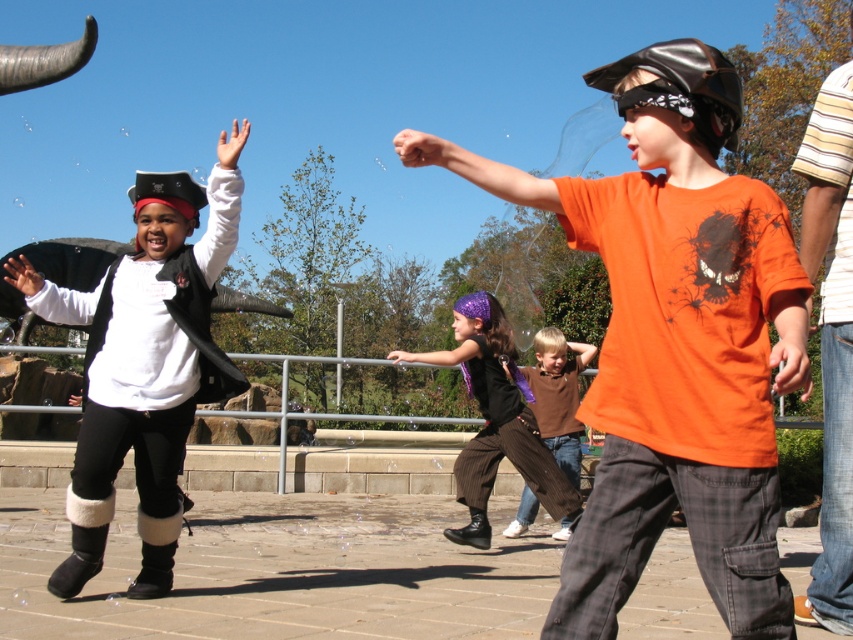
Question: Is matte black vest at left wider than brown cotton shirt at center?

Choices:
 (A) yes
 (B) no

Answer: (A)

Question: Which object is the closest to the orange matte shirt at center?

Choices:
 (A) black pinstripe pants at center
 (B) brown cotton shirt at center
 (C) matte black vest at left

Answer: (C)

Question: Among these points, which one is nearest to the camera?

Choices:
 (A) (90, 376)
 (B) (734, 490)
 (C) (566, 371)

Answer: (B)

Question: Where is orange matte shirt at center located in relation to matte black vest at left in the image?

Choices:
 (A) left
 (B) right

Answer: (B)

Question: Can you confirm if orange matte shirt at center is thinner than matte black vest at left?

Choices:
 (A) no
 (B) yes

Answer: (B)

Question: Which is nearer to the brown cotton shirt at center?

Choices:
 (A) black pinstripe pants at center
 (B) matte black vest at left

Answer: (A)